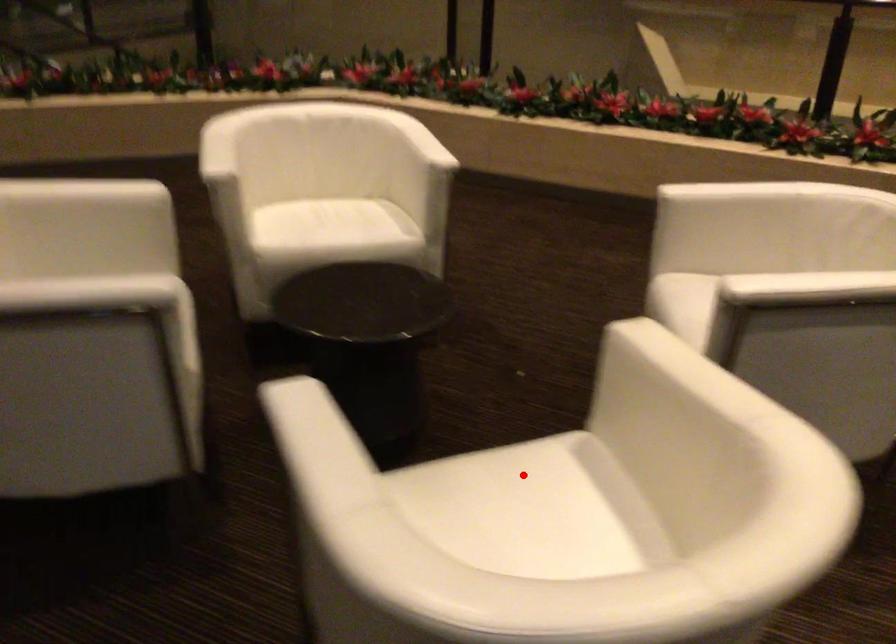
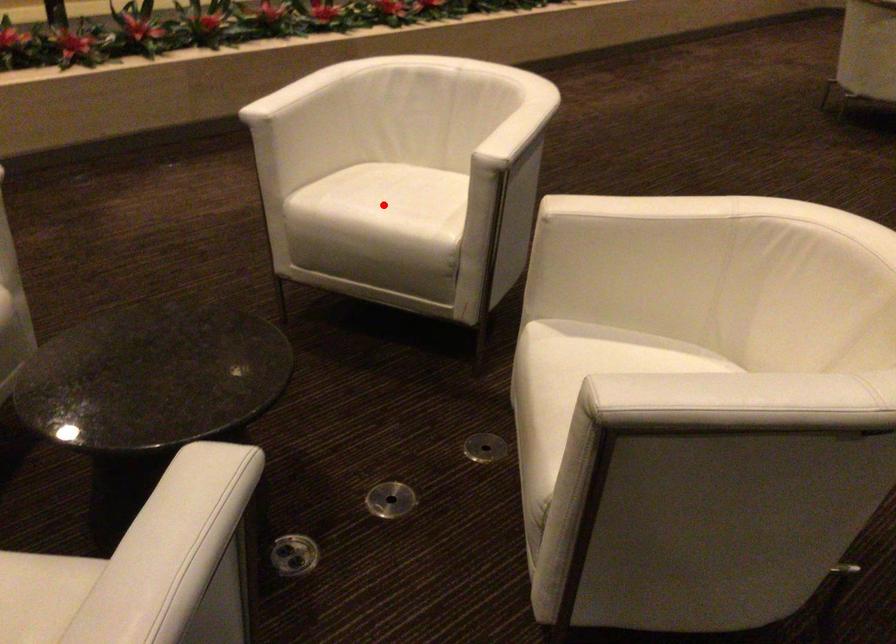
I am providing you with two images of the same scene from different viewpoints. A red point is marked on the first image and another point is marked on the second image. Is the marked point in image1 the same physical position as the marked point in image2?

No